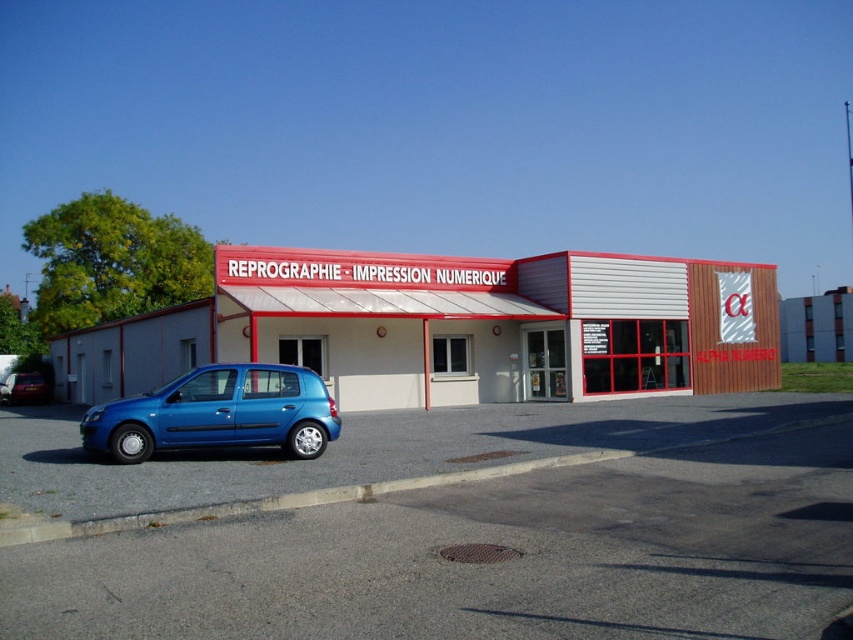
You are a delivery driver who just arrived at the commercial building. You see the gray asphalt parking lot at lower left and the blue metallic car at lower left. Which object is positioned higher from the ground?

The gray asphalt parking lot at lower left is located above the blue metallic car at lower left, so the parking lot is higher from the ground than the car.